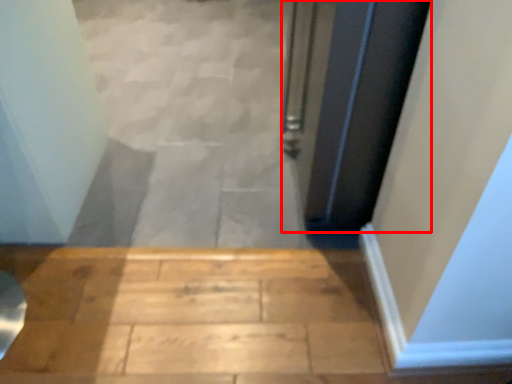
Question: From the image's perspective, considering the relative positions of door (annotated by the red box) and stairwell in the image provided, where is door (annotated by the red box) located with respect to the staircase?

Choices:
 (A) above
 (B) below

Answer: (B)